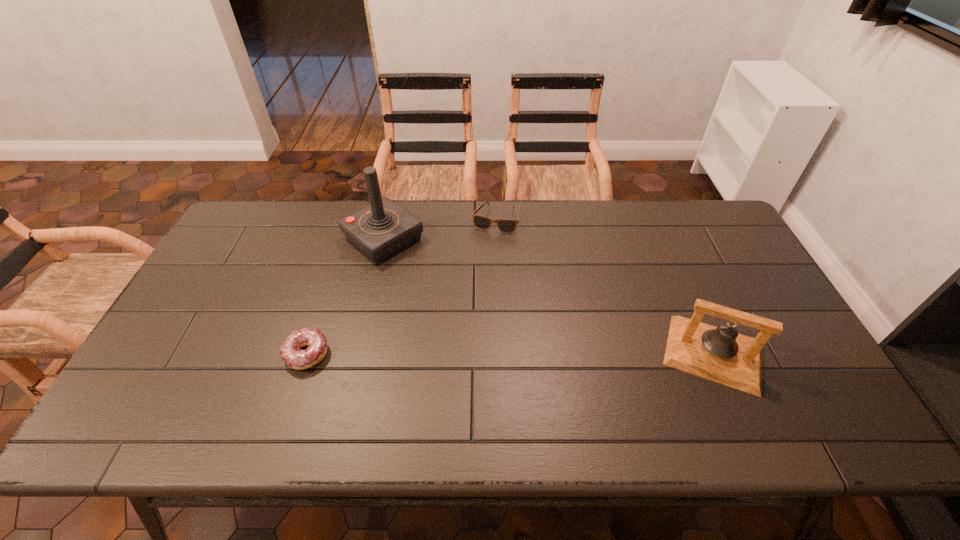
This screenshot has width=960, height=540. I want to click on free point between the bell and the joystick, so click(548, 296).

Find the location of a particular element. vacant region between the joystick and the sunglasses is located at coordinates (439, 229).

At what (x,y) coordinates should I click in order to perform the action: click on free space between the joystick and the second object from right to left. Please return your answer as a coordinate pair (x, y). The image size is (960, 540). Looking at the image, I should click on (439, 229).

Identify the location of object that is the second nearest to the doughnut. The width and height of the screenshot is (960, 540). (481, 222).

Image resolution: width=960 pixels, height=540 pixels. I want to click on object that stands as the second closest to the joystick, so click(x=297, y=359).

Where is `vacant area in the image that satisfies the following two spatial constraints: 1. on the back side of the second object from right to left; 2. on the right side of the tallest object`? The height and width of the screenshot is (540, 960). vacant area in the image that satisfies the following two spatial constraints: 1. on the back side of the second object from right to left; 2. on the right side of the tallest object is located at coordinates (388, 220).